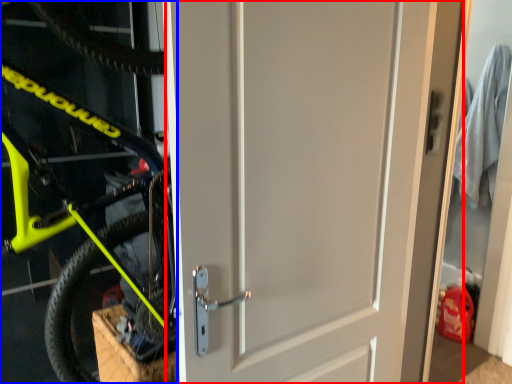
Question: Which object appears farthest to the camera in this image, door (highlighted by a red box) or bicycle (highlighted by a blue box)?

Choices:
 (A) door
 (B) bicycle

Answer: (A)